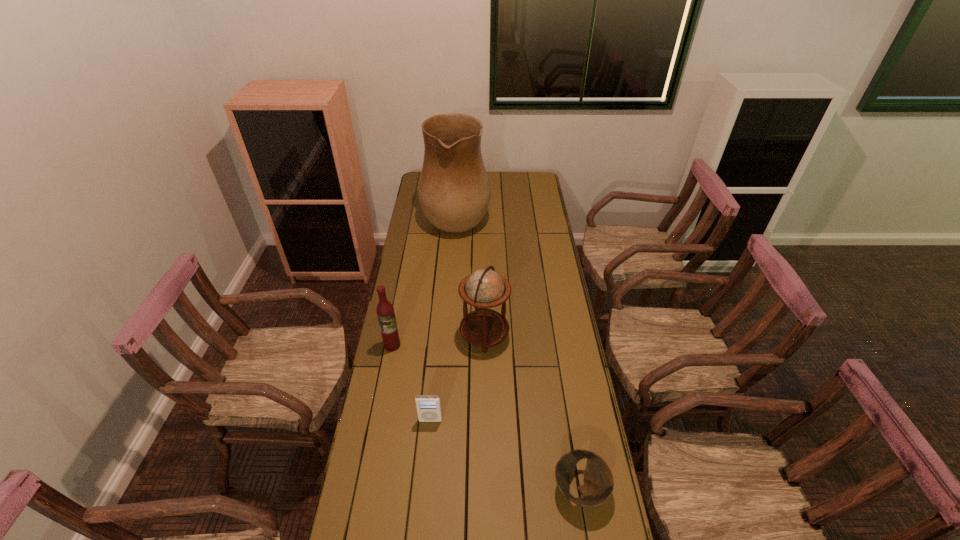
Identify the location of vacant space located 0.090m on the surface of the globe. (438, 335).

At what (x,y) coordinates should I click in order to perform the action: click on vacant space situated on the surface of the globe. Please return your answer as a coordinate pair (x, y). This screenshot has width=960, height=540. Looking at the image, I should click on (405, 335).

In order to click on vacant space located on the label of the leftmost object in this screenshot , I will do `click(377, 423)`.

Identify the location of vacant area located on the front-facing side of the iPod. The width and height of the screenshot is (960, 540). (426, 463).

Locate an element on the screen. The height and width of the screenshot is (540, 960). vacant space situated 0.360m on the back of the rightmost object is located at coordinates (560, 367).

Identify the location of object present at the far edge. The image size is (960, 540). (454, 192).

Where is `cream pitcher that is at the left edge`? The width and height of the screenshot is (960, 540). cream pitcher that is at the left edge is located at coordinates (454, 192).

The width and height of the screenshot is (960, 540). Identify the location of liquor that is at the left edge. (385, 312).

Where is `object that is at the right edge`? This screenshot has width=960, height=540. object that is at the right edge is located at coordinates (598, 485).

The width and height of the screenshot is (960, 540). Identify the location of object present at the far left corner. click(454, 192).